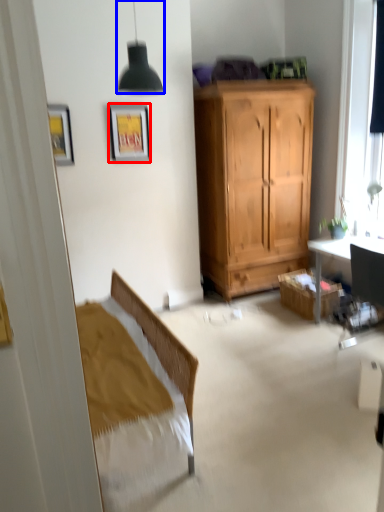
Question: Which point is further to the camera, picture frame (highlighted by a red box) or lamp (highlighted by a blue box)?

Choices:
 (A) picture frame
 (B) lamp

Answer: (A)